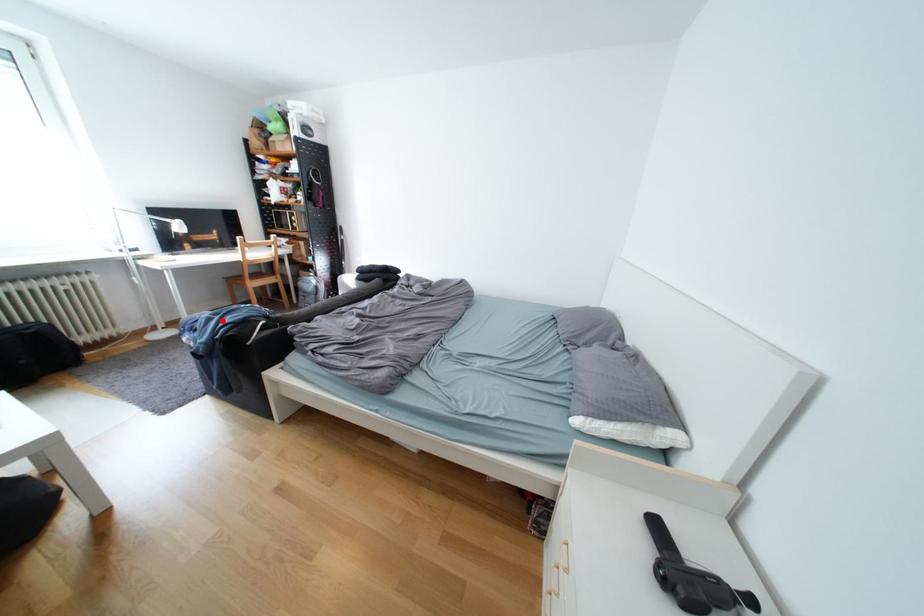
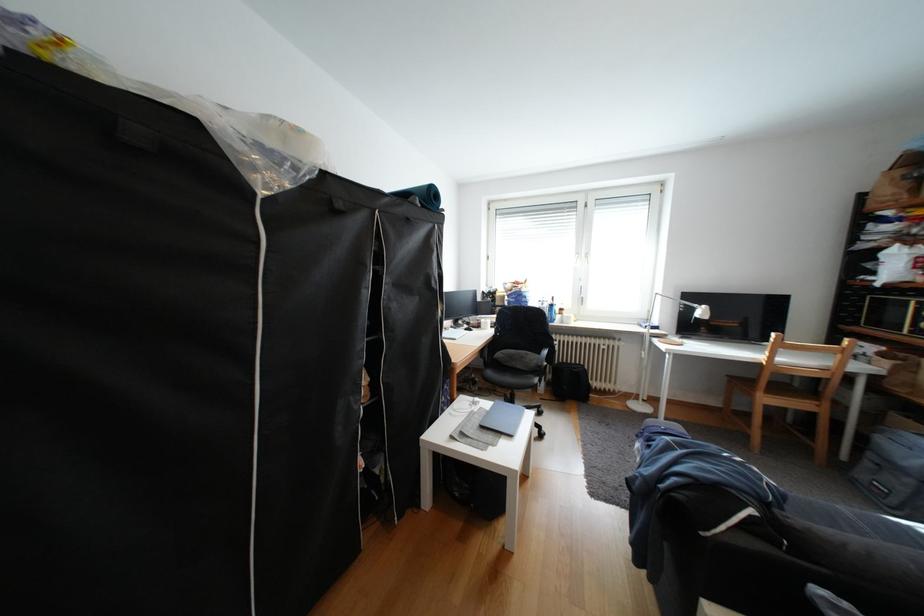
In the second image, find the point that corresponds to the highlighted location in the first image.

(682, 448)